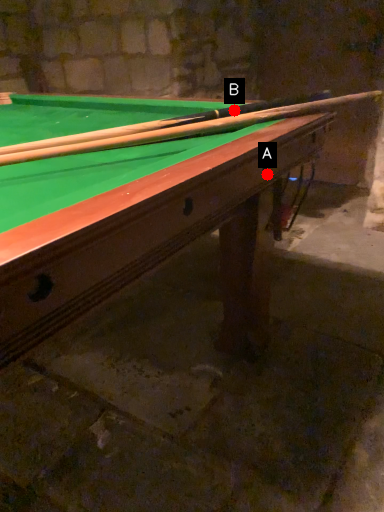
Question: Two points are circled on the image, labeled by A and B beside each circle. Which point is closer to the camera taking this photo?

Choices:
 (A) A is closer
 (B) B is closer

Answer: (A)